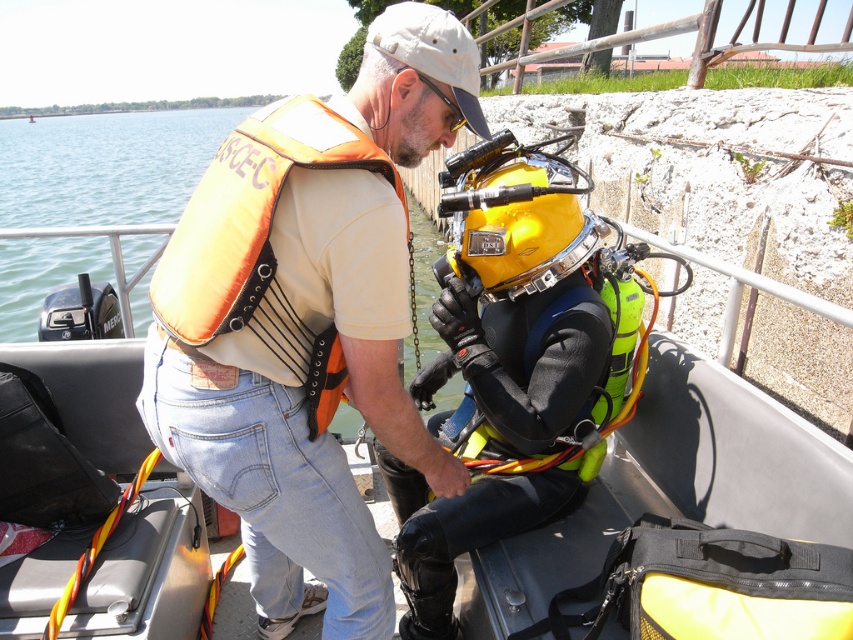
You are a safety inspector checking the diving equipment setup on the boat. You need to ensure that the yellow matte helmet at center and the orange fabric life jacket at upper left are arranged properly. Based on their sizes, which object is wider?

The yellow matte helmet at center is wider than the orange fabric life jacket at upper left according to the description provided.

You are a safety inspector checking the equipment on the boat. You notice the orange fabric life vest at center and the metallic gray boat at center. Which object has a greater width?

The orange fabric life vest at center has a greater width than the metallic gray boat at center.